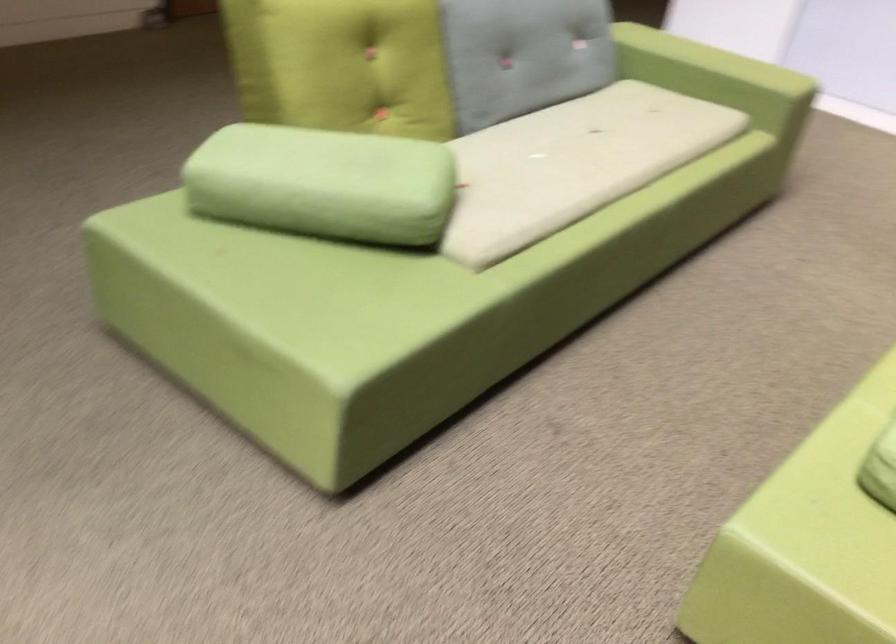
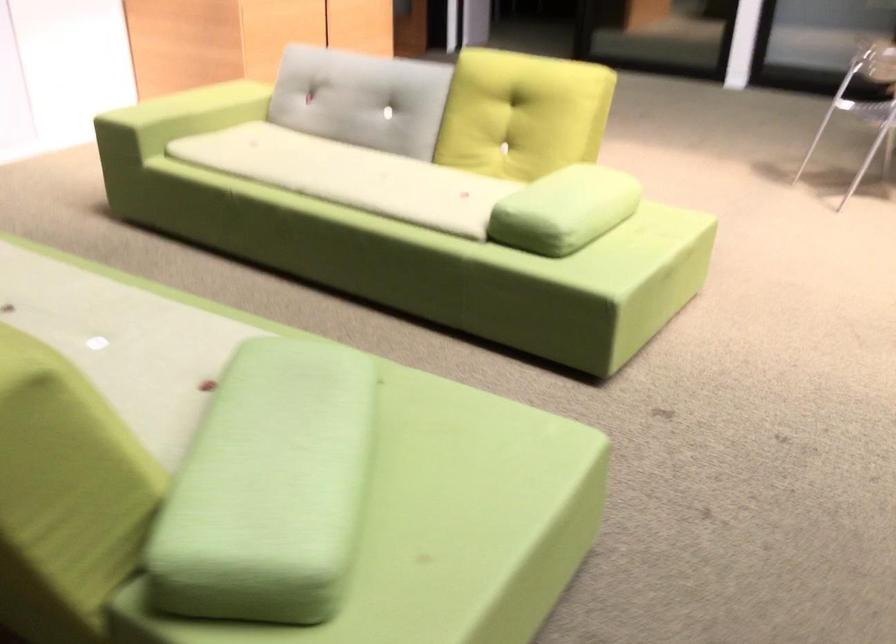
Locate, in the second image, the point that corresponds to the point at 607,131 in the first image.

(66, 290)